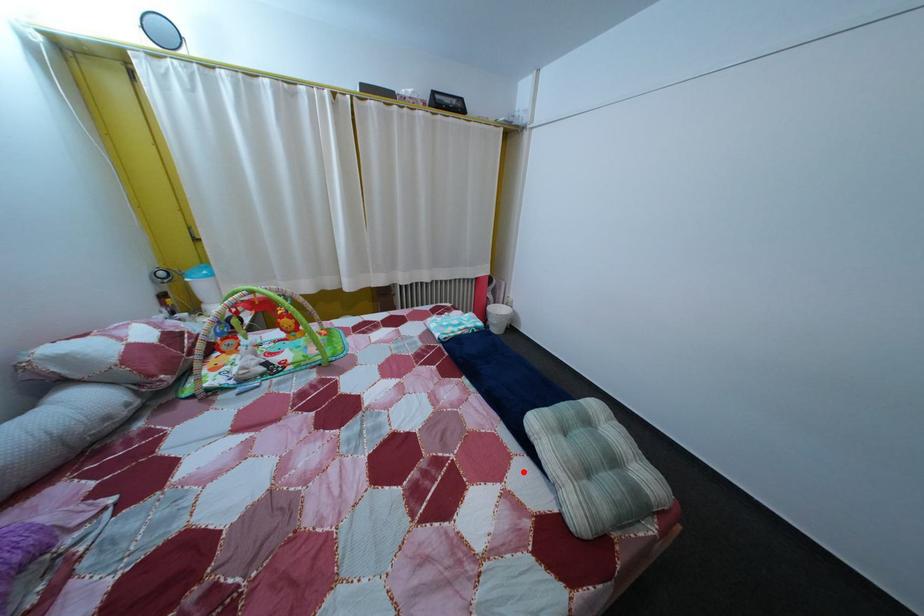
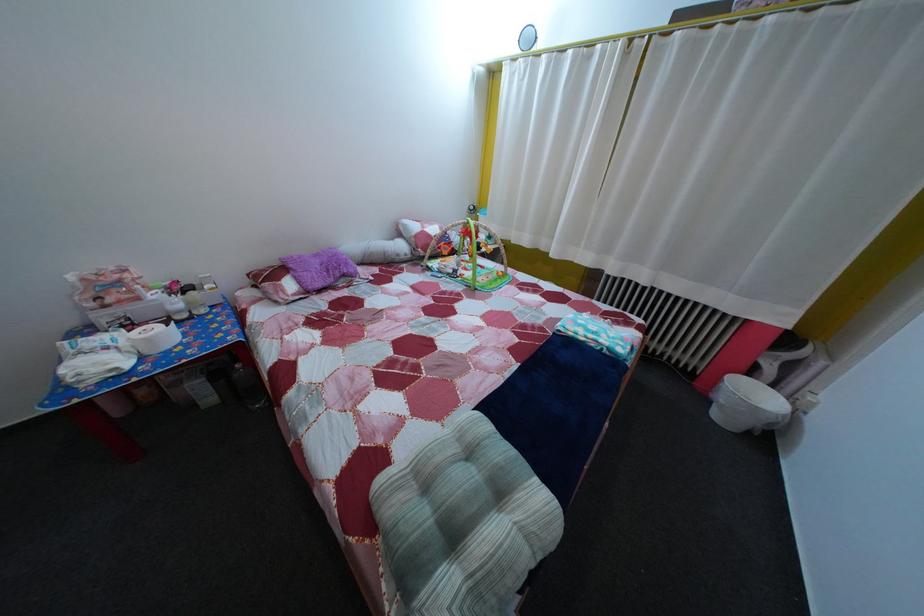
Find the pixel in the second image that matches the highlighted location in the first image.

(442, 432)